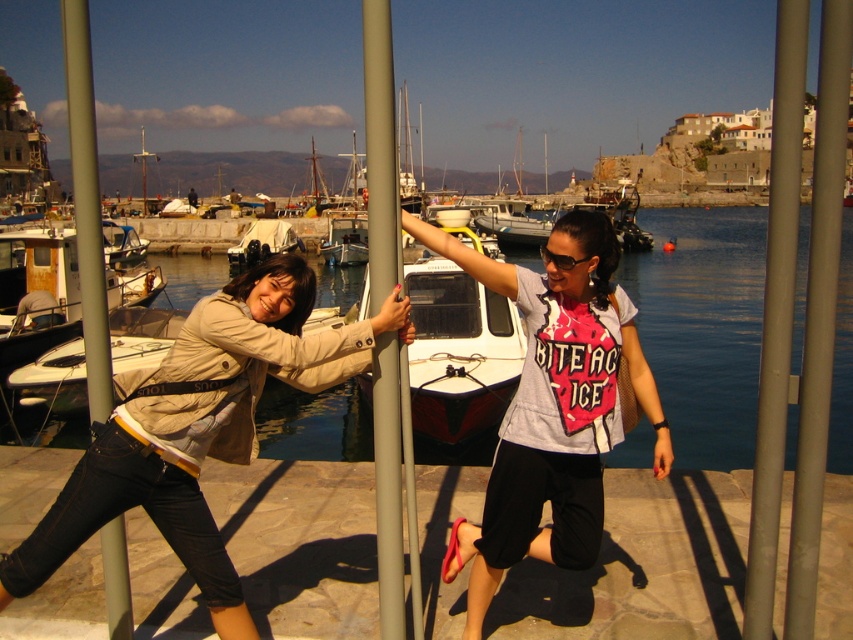
Is satin silver pole at center wider than smooth gray pole at left?

No.

Locate an element on the screen. Image resolution: width=853 pixels, height=640 pixels. satin silver pole at center is located at coordinates (380, 150).

At what (x,y) coordinates should I click in order to perform the action: click on satin silver pole at center. Please return your answer as a coordinate pair (x, y). The width and height of the screenshot is (853, 640). Looking at the image, I should click on (380, 150).

Does rusty metal boat at left appear under white tarpaulin boat at center?

Indeed, rusty metal boat at left is positioned under white tarpaulin boat at center.

Which is more to the right, rusty metal boat at left or white tarpaulin boat at center?

white tarpaulin boat at center

This screenshot has width=853, height=640. What do you see at coordinates (36, 292) in the screenshot?
I see `rusty metal boat at left` at bounding box center [36, 292].

This screenshot has width=853, height=640. Identify the location of rusty metal boat at left. (36, 292).

Can you confirm if metallic gray pole at center is thinner than rusty metal boat at left?

Yes.

Locate an element on the screen. This screenshot has height=640, width=853. metallic gray pole at center is located at coordinates (817, 317).

At what (x,y) coordinates should I click in order to perform the action: click on metallic gray pole at center. Please return your answer as a coordinate pair (x, y). Looking at the image, I should click on (817, 317).